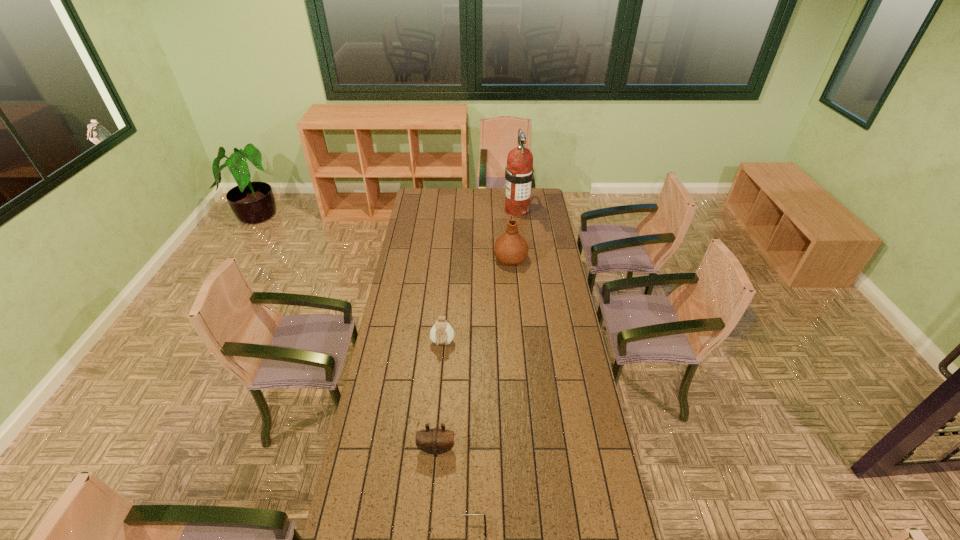
Locate an element on the screen. The height and width of the screenshot is (540, 960). the tallest object is located at coordinates (519, 172).

Locate an element on the screen. fire extinguisher is located at coordinates (519, 172).

Where is `the fourth nearest object`? Image resolution: width=960 pixels, height=540 pixels. the fourth nearest object is located at coordinates (511, 248).

You are a GUI agent. You are given a task and a screenshot of the screen. Output one action in this format:
    pyautogui.click(x=<x>, y=<y>)
    Task: Click on the pitcher
    The height and width of the screenshot is (540, 960).
    Given the screenshot: What is the action you would take?
    pyautogui.click(x=511, y=248)

At what (x,y) coordinates should I click in order to perform the action: click on the farther pouch. Please return your answer as a coordinate pair (x, y). This screenshot has height=540, width=960. Looking at the image, I should click on pos(441,333).

Identify the location of the taller pouch. The width and height of the screenshot is (960, 540). (441, 333).

Where is `the shorter pouch`? This screenshot has width=960, height=540. the shorter pouch is located at coordinates (435, 441).

Find the location of a particular element. the nearer pouch is located at coordinates (435, 441).

Locate an element on the screen. The height and width of the screenshot is (540, 960). vacant space located at the nozzle of the tallest object is located at coordinates (521, 244).

Image resolution: width=960 pixels, height=540 pixels. What are the coordinates of `free space located on the side of the fourth shortest object with the handle` in the screenshot? It's located at (508, 227).